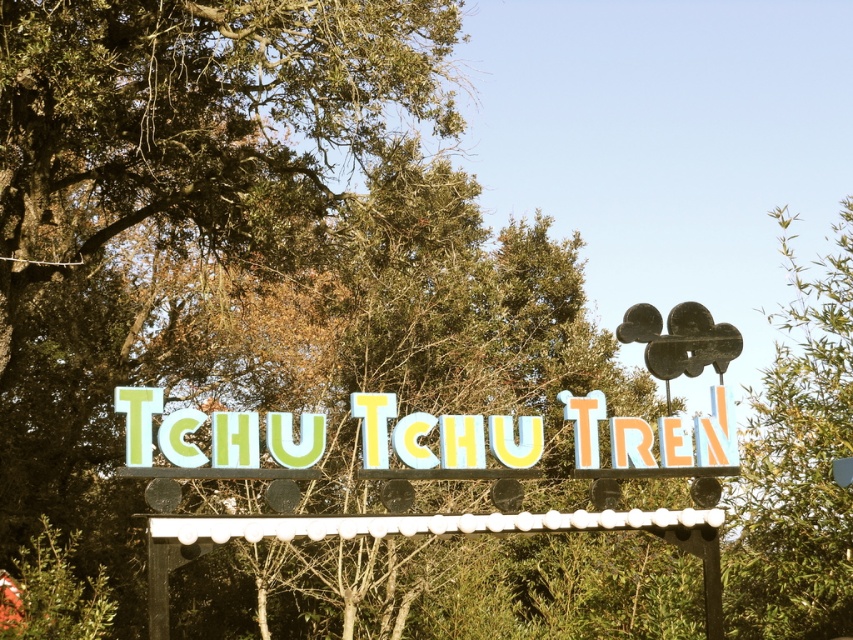
Based on the photo, is green leafy tree at upper right below pastel painted letters at center?

Actually, green leafy tree at upper right is above pastel painted letters at center.

Who is lower down, green leafy tree at upper right or pastel painted letters at center?

pastel painted letters at center is lower down.

Describe the element at coordinates (798, 461) in the screenshot. I see `green leafy tree at upper right` at that location.

Where is `green leafy tree at upper right`? green leafy tree at upper right is located at coordinates (798, 461).